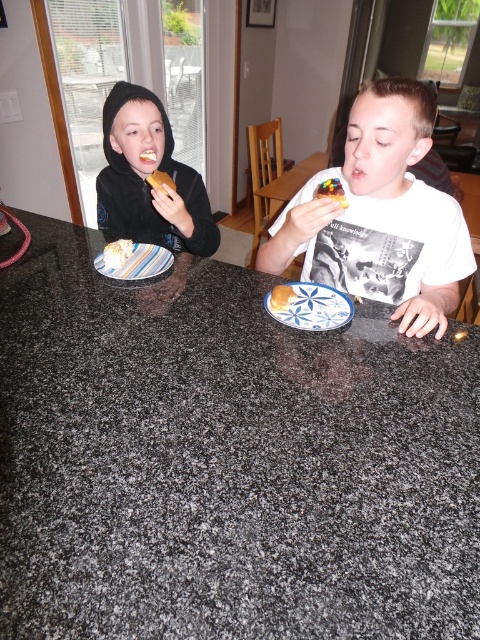
You are a chef standing 1 meter away from the matte brown pastry at center. Can you reach it without moving?

The matte brown pastry at center is 1.10 meters away from the viewer, so you are 0.10 meters too far to reach it without moving.

You are a photographer standing at a certain distance from the striped paper plate at center. You want to capture a closeup shot of the plate without any distortion. According to the scene description, what is the minimum distance you should maintain from the plate to avoid distortion?

The striped paper plate at center and camera are 4.30 feet apart, so to avoid distortion, the photographer should maintain a minimum distance of 4.30 feet from the plate.

You are a chef who needs to place a dessert platter exactly halfway between the striped paper plate at center and the matte yellow cake at center. What is the minimum distance you should measure from each object to ensure the platter is placed correctly?

The distance between the striped paper plate at center and the matte yellow cake at center is 20.41 centimeters. To place the dessert platter exactly halfway, you should measure 10.205 centimeters from each object.